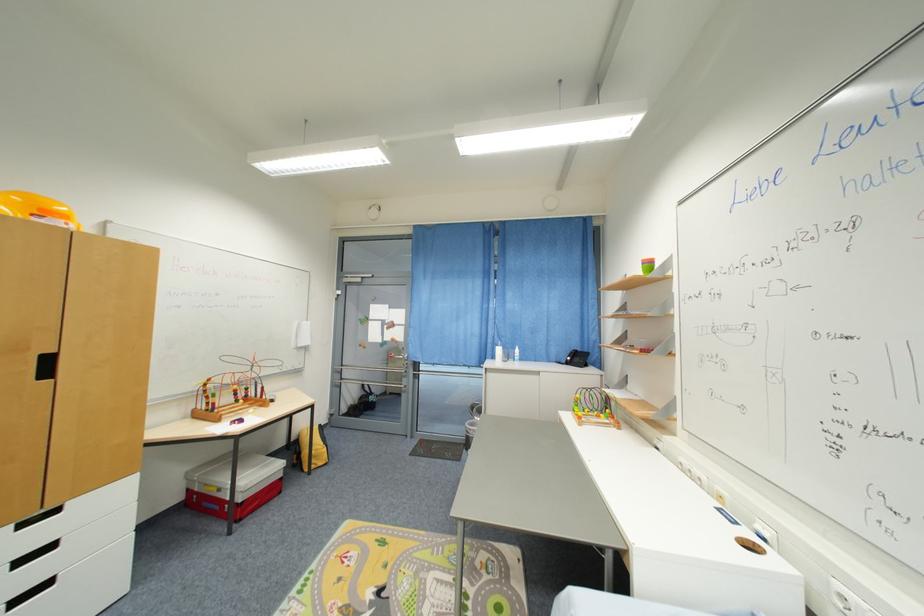
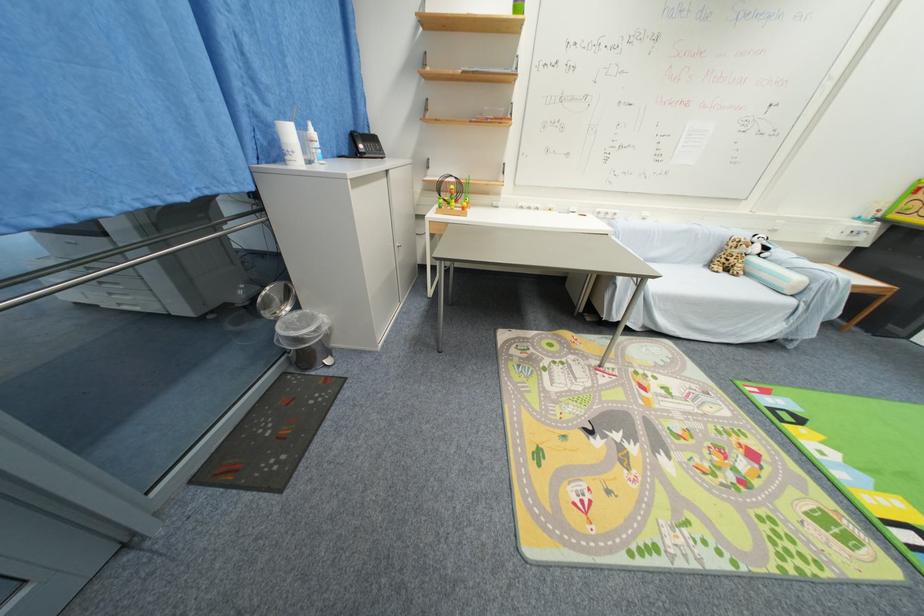
Find the pixel in the second image that matches point (581, 361) in the first image.

(377, 148)